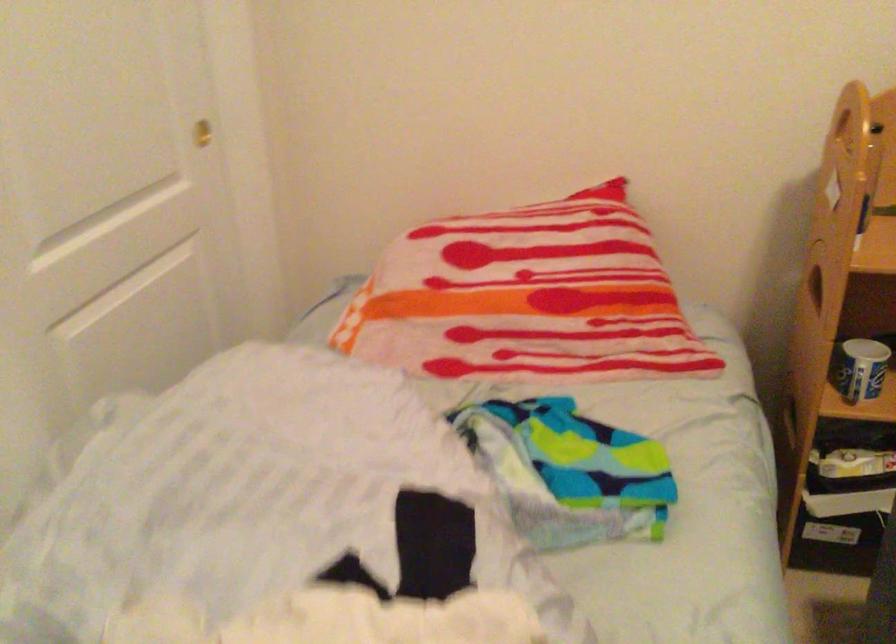
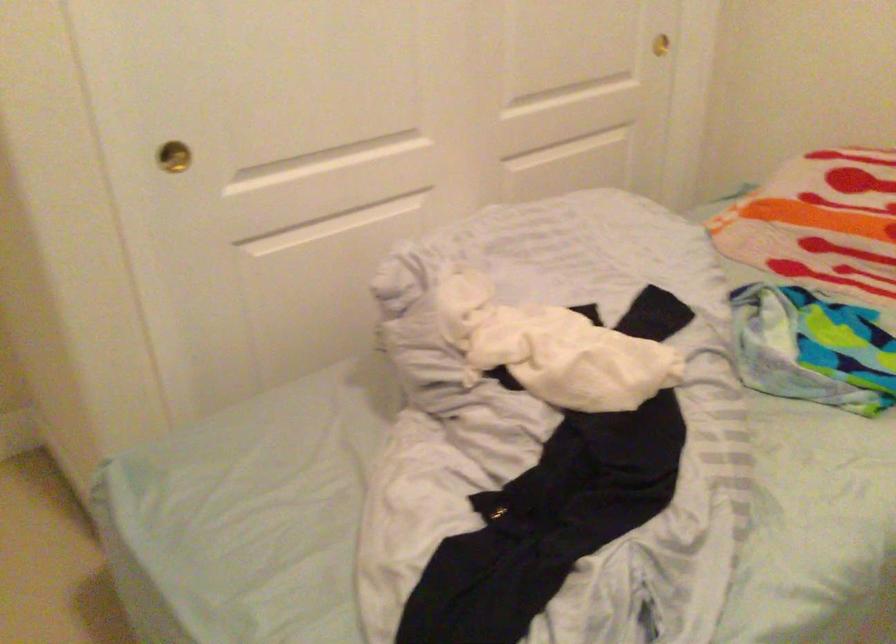
Locate, in the second image, the point that corresponds to (219,142) in the first image.

(664, 44)